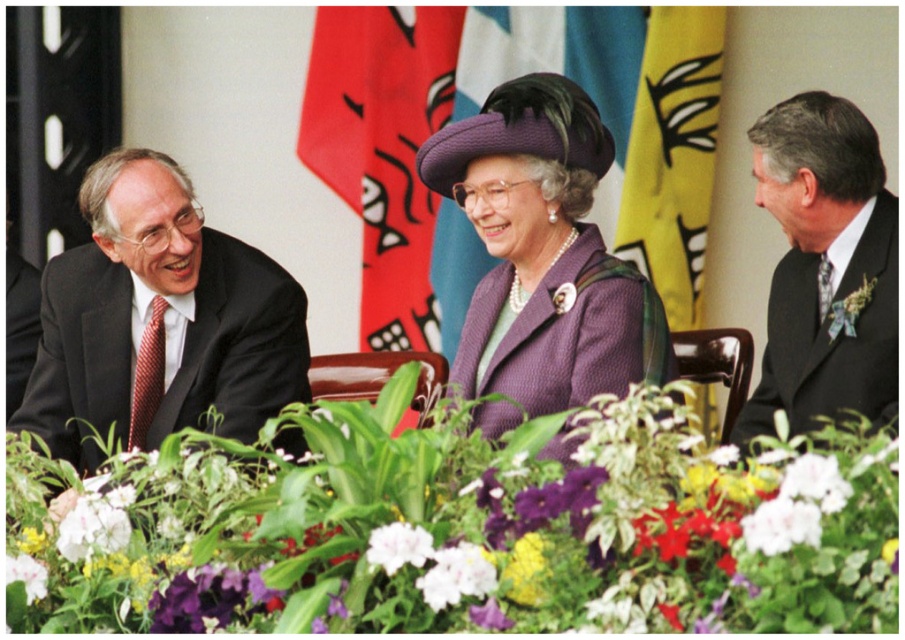
Question: Which of these objects is positioned closest to the black suit at left?

Choices:
 (A) dark gray suit at right
 (B) vivid purple petals at center

Answer: (B)

Question: Which object appears closest to the camera in this image?

Choices:
 (A) purple woolen coat at center
 (B) black suit at left
 (C) purple textured coat at center
 (D) dark gray suit at right

Answer: (D)

Question: Considering the real-world distances, which object is farthest from the white matte flower at center?

Choices:
 (A) purple woolen coat at center
 (B) purple textured coat at center
 (C) vivid purple petals at center
 (D) black suit at left

Answer: (D)

Question: Does purple textured coat at center appear under dark gray suit at right?

Choices:
 (A) yes
 (B) no

Answer: (B)

Question: From the image, what is the correct spatial relationship of black suit at left in relation to purple woolen coat at center?

Choices:
 (A) right
 (B) left

Answer: (B)

Question: Is purple textured coat at center in front of white matte flower at center?

Choices:
 (A) no
 (B) yes

Answer: (A)